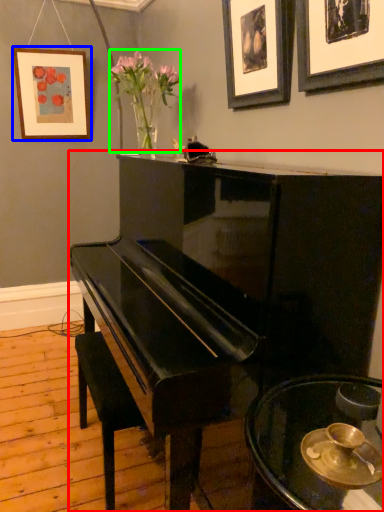
Question: Which object is the farthest from piano (highlighted by a red box)? Choose among these: picture frame (highlighted by a blue box) or floral arrangement (highlighted by a green box).

Choices:
 (A) picture frame
 (B) floral arrangement

Answer: (A)